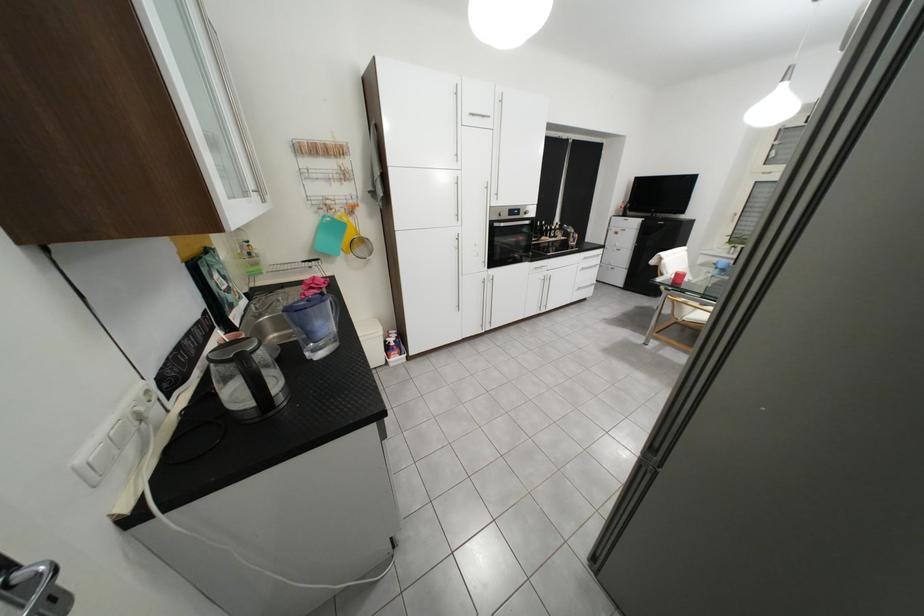
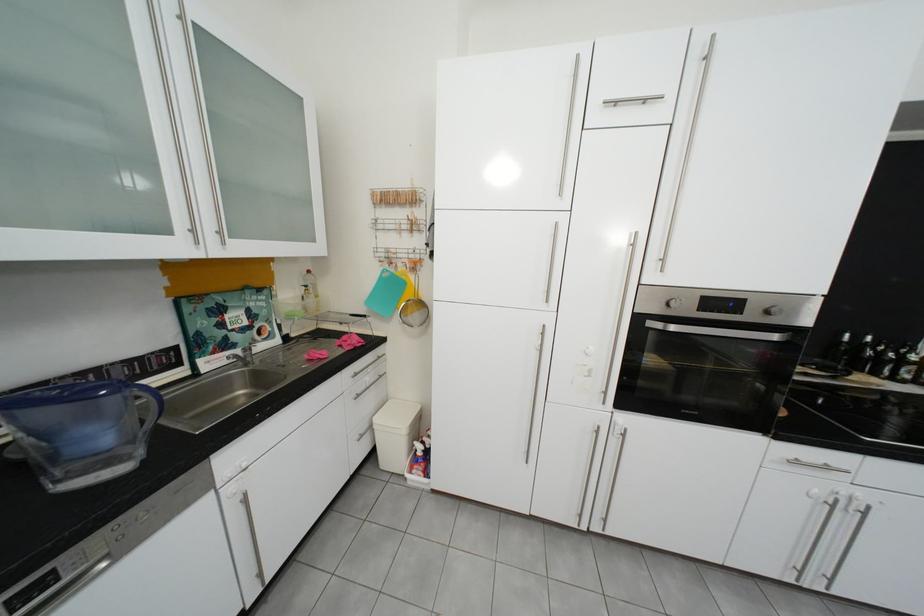
In the second image, find the point that corresponds to point (553, 224) in the first image.

(869, 339)